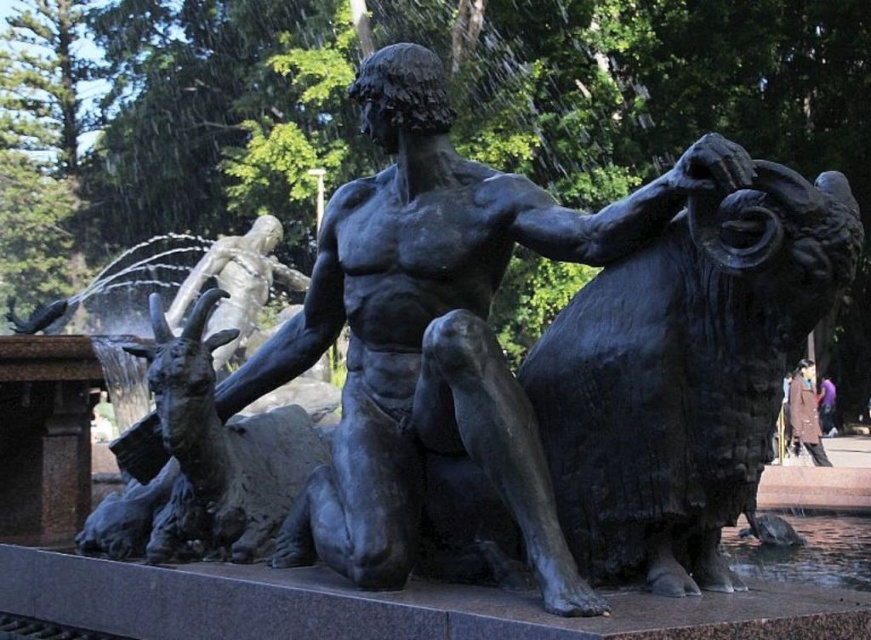
Question: Which of the following is the closest to the observer?

Choices:
 (A) bronze muscular figure at center
 (B) brown leather jacket at lower right

Answer: (A)

Question: Does bronze muscular figure at center have a lesser width compared to brown leather jacket at lower right?

Choices:
 (A) yes
 (B) no

Answer: (A)

Question: Does bronze muscular figure at center have a larger size compared to brown leather jacket at lower right?

Choices:
 (A) yes
 (B) no

Answer: (B)

Question: Which point is closer to the camera?

Choices:
 (A) (220, 412)
 (B) (819, 451)

Answer: (A)

Question: Is bronze muscular figure at center thinner than brown leather jacket at lower right?

Choices:
 (A) yes
 (B) no

Answer: (A)